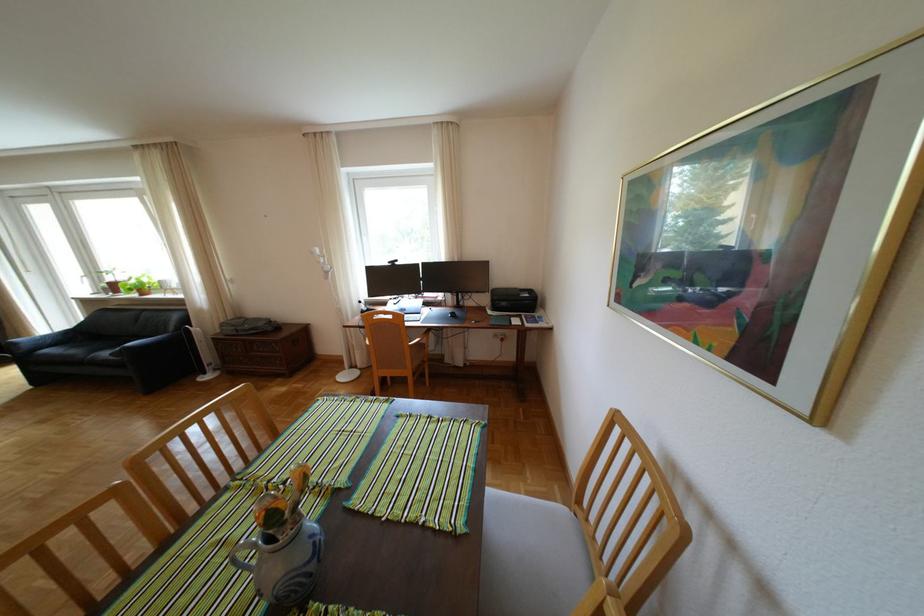
The location [248,321] corresponds to which object?

It corresponds to the grey bag in the image.